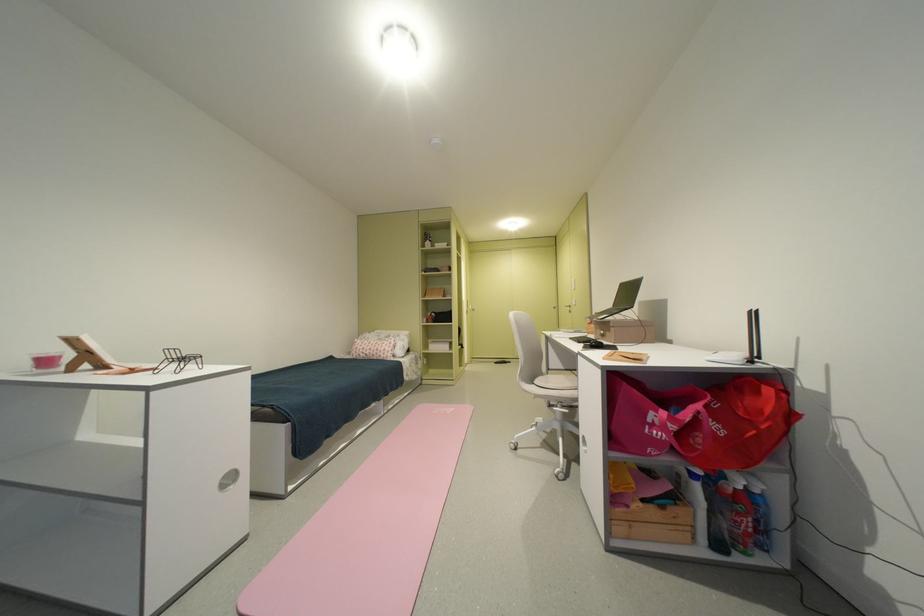
Identify the location of wardrobe door handle. (570, 302).